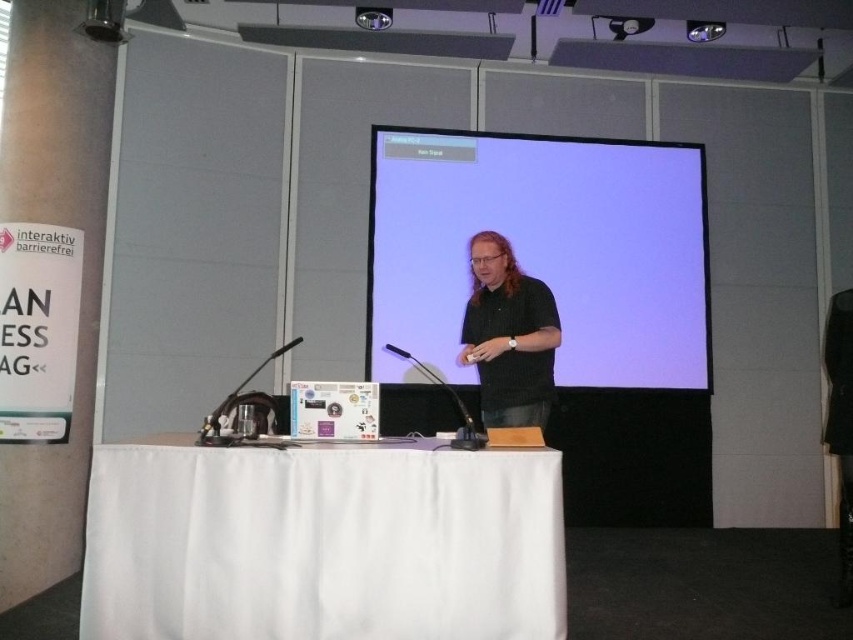
You are an attendee at the presentation and want to know which object is wider between the matte black screen at center and the black matte shirt at center. Can you determine this based on the scene?

The matte black screen at center is wider than the black matte shirt at center according to the description.

You are sitting in the audience and want to look at both the matte black screen at center and the black matte shirt at center. Which object should you look to your left to see?

The matte black screen at center is to the right of the black matte shirt at center, so to see both, you should look to your left to see the black matte shirt at center first and then shift your gaze to the right to view the matte black screen at center.